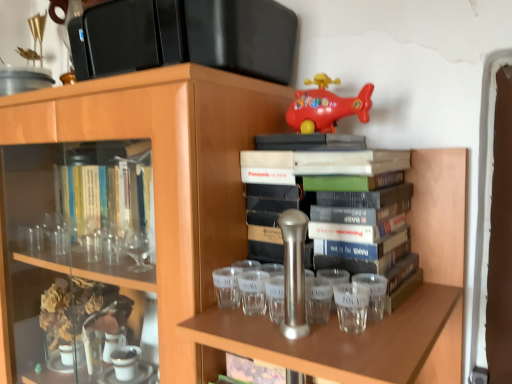
Question: Is point (378, 274) closer or farther from the camera than point (251, 276)?

Choices:
 (A) farther
 (B) closer

Answer: (B)

Question: From a real-world perspective, relative to transparent glass shot glass at center, the second shot glass in the left-to-right sequence, is transparent glass shot glass at right, the first shot glass from the right, vertically above or below?

Choices:
 (A) above
 (B) below

Answer: (A)

Question: Estimate the real-world distances between objects in this image. Which object is closer to the transparent glass shot glass at center, the second shot glass in the left-to-right sequence?

Choices:
 (A) hardcover book at center
 (B) rubber red airplane at upper center
 (C) transparent glass shot glass at center, which ranks as the 1th shot glass in left-to-right order
 (D) transparent glass shot glass at right, the 3th shot glass viewed from the left

Answer: (C)

Question: Which object is the farthest from the transparent glass shot glass at right, the 3th shot glass viewed from the left?

Choices:
 (A) rubber red airplane at upper center
 (B) hardcover book at center
 (C) transparent glass shot glass at center, the second shot glass in the left-to-right sequence
 (D) transparent glass shot glass at center, which ranks as the 1th shot glass in left-to-right order

Answer: (A)